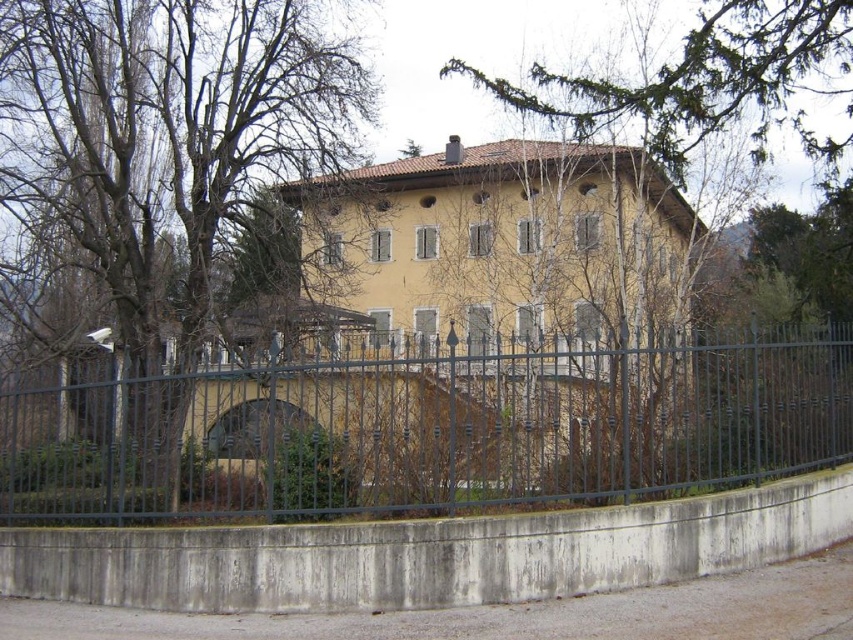
Which is behind, point (74, 413) or point (717, 120)?

The point (717, 120) is behind.

Who is shorter, metallic dark green fence at center or green leafy tree at upper center?

With less height is green leafy tree at upper center.

Is point (149, 417) positioned after point (801, 68)?

No, it is in front of (801, 68).

Where is `metallic dark green fence at center`? metallic dark green fence at center is located at coordinates (424, 429).

Which is below, bare branches at left or green leafy tree at upper center?

bare branches at left is lower down.

Between bare branches at left and green leafy tree at upper center, which one has less height?

green leafy tree at upper center

Measure the distance between point [178,260] and camera.

Point [178,260] is 68.46 feet from camera.

Find the location of `bare branches at left`. bare branches at left is located at coordinates (170, 138).

Image resolution: width=853 pixels, height=640 pixels. I want to click on metallic dark green fence at center, so click(x=424, y=429).

Is point (1, 420) less distant than point (360, 74)?

Yes, point (1, 420) is closer to viewer.

Identify the location of metallic dark green fence at center. (424, 429).